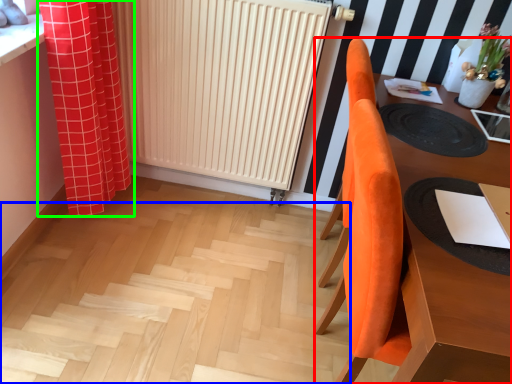
Question: Which object is positioned farthest from furniture (highlighted by a red box)? Select from stairs (highlighted by a blue box) and curtain (highlighted by a green box).

Choices:
 (A) stairs
 (B) curtain

Answer: (B)